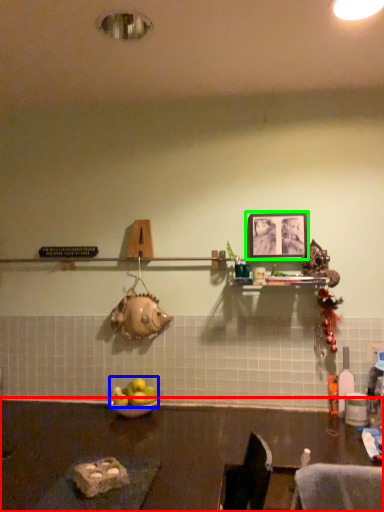
Question: Which object is positioned closest to table (highlighted by a red box)? Select from apple (highlighted by a blue box) and picture frame (highlighted by a green box).

Choices:
 (A) apple
 (B) picture frame

Answer: (A)